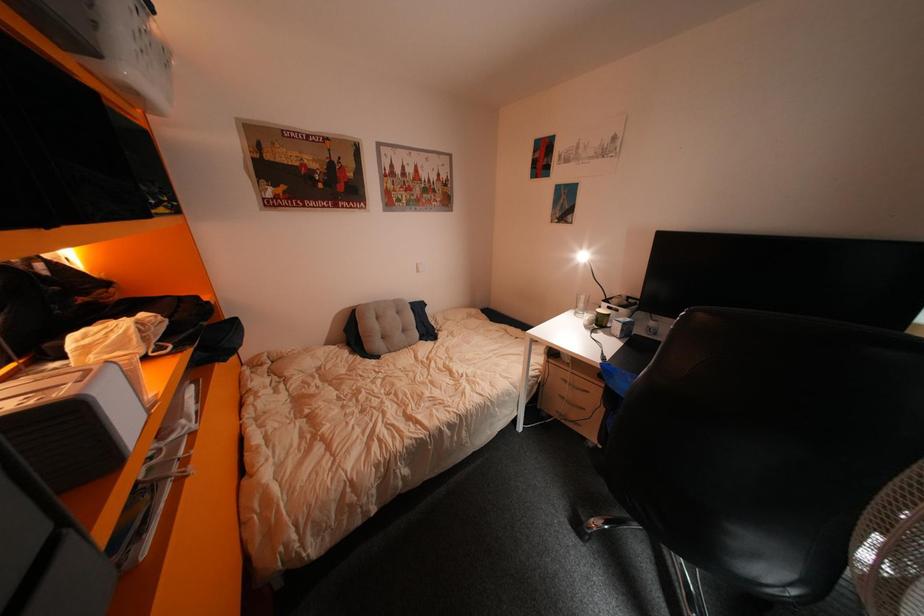
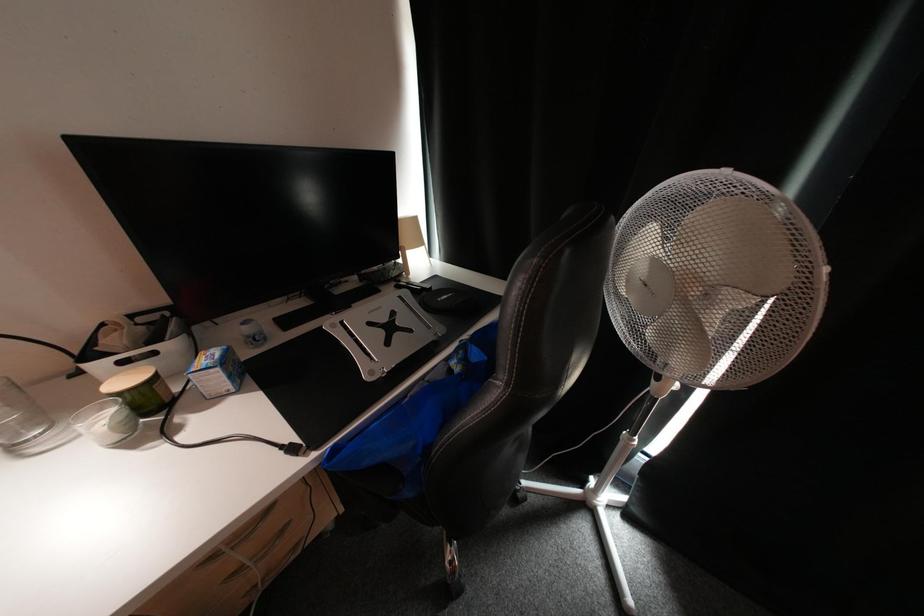
First-person continuous shooting, in which direction is the camera rotating?

The rotation direction of the camera is right-down.